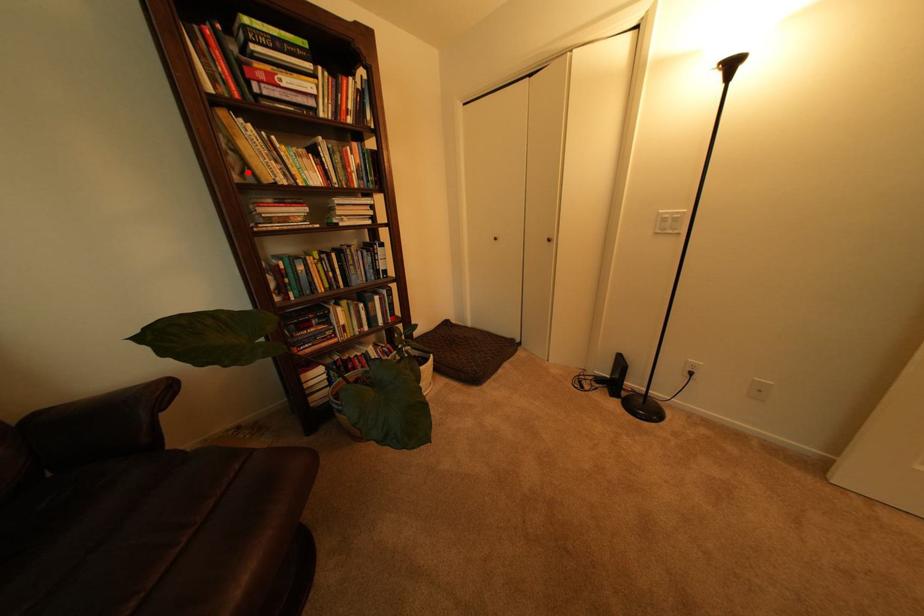
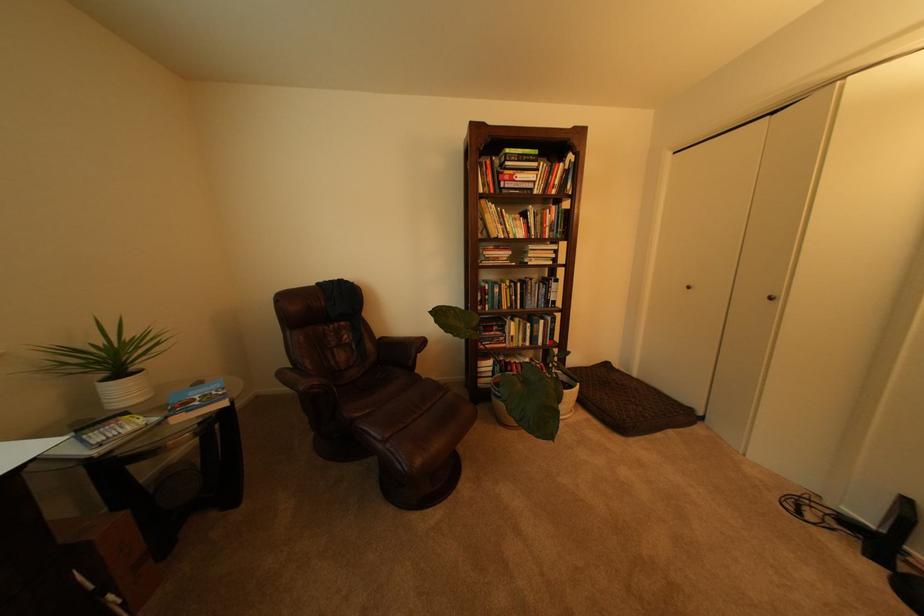
The point at the highlighted location is marked in the first image. Where is the corresponding point in the second image?

(492, 232)